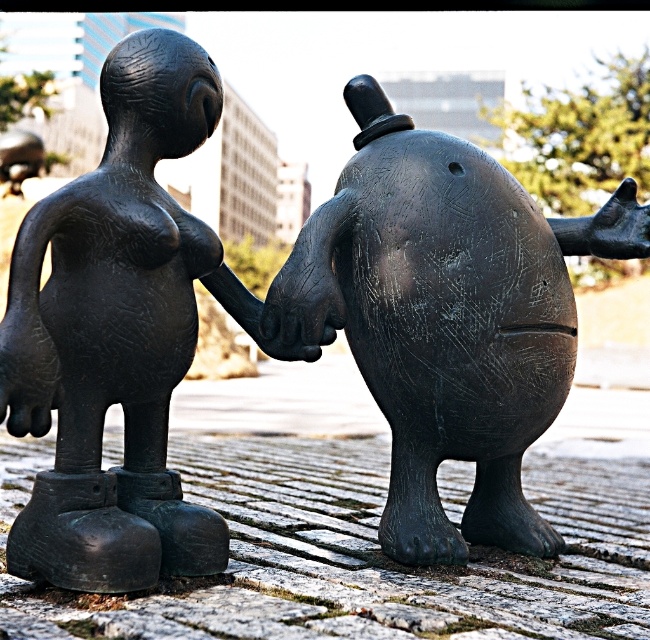
Question: Can you confirm if matte black sculpture at center is wider than matte black statue at center?

Choices:
 (A) yes
 (B) no

Answer: (A)

Question: Is the position of matte black sculpture at center more distant than that of matte black statue at center?

Choices:
 (A) yes
 (B) no

Answer: (A)

Question: Observing the image, what is the correct spatial positioning of matte black sculpture at center in reference to matte black statue at center?

Choices:
 (A) right
 (B) left

Answer: (A)